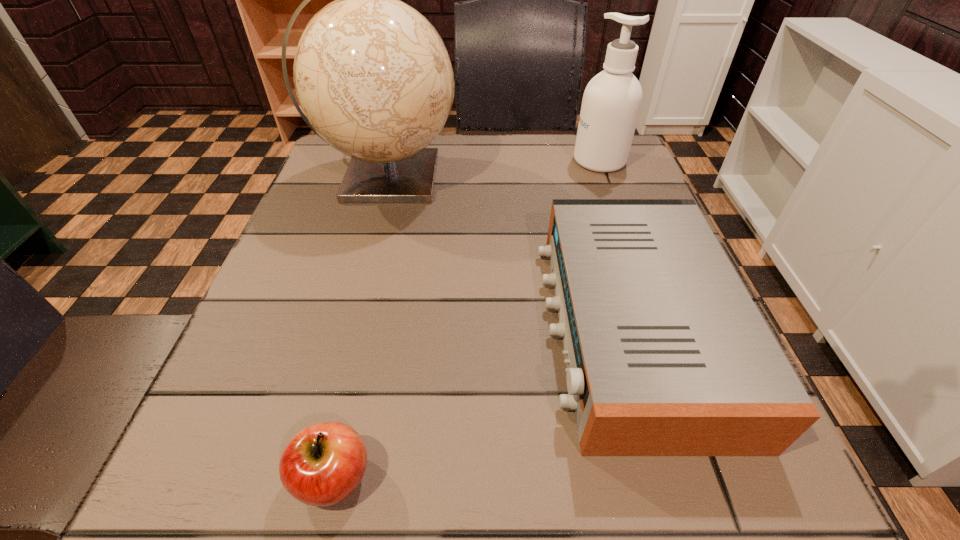
You are a GUI agent. You are given a task and a screenshot of the screen. Output one action in this format:
    pyautogui.click(x=<x>, y=<y>)
    Task: Click on the tallest object
    The height and width of the screenshot is (540, 960).
    Given the screenshot: What is the action you would take?
    pyautogui.click(x=373, y=76)

This screenshot has height=540, width=960. In order to click on the second tallest object in this screenshot , I will do `click(612, 100)`.

Where is `radio receiver`? Image resolution: width=960 pixels, height=540 pixels. radio receiver is located at coordinates (667, 355).

The image size is (960, 540). Find the location of `apple`. apple is located at coordinates (323, 464).

Identify the location of free space located on the surface of the globe showing Europe and Africa. The image size is (960, 540). (555, 178).

Find the location of a particular element. The width and height of the screenshot is (960, 540). vacant space situated 0.290m on the front label of the cleansing agent is located at coordinates (452, 161).

Image resolution: width=960 pixels, height=540 pixels. Find the location of `vacant region located 0.400m on the front label of the cleansing agent`. vacant region located 0.400m on the front label of the cleansing agent is located at coordinates (405, 161).

Identify the location of free spot located 0.250m on the front label of the cleansing agent. (468, 161).

At what (x,y) coordinates should I click in order to perform the action: click on vacant point located on the control panel of the radio receiver. Please return your answer as a coordinate pair (x, y). The image size is (960, 540). Looking at the image, I should click on (516, 327).

At what (x,y) coordinates should I click in order to perform the action: click on vacant space located 0.160m on the control panel of the radio receiver. Please return your answer as a coordinate pair (x, y). Looking at the image, I should click on (445, 327).